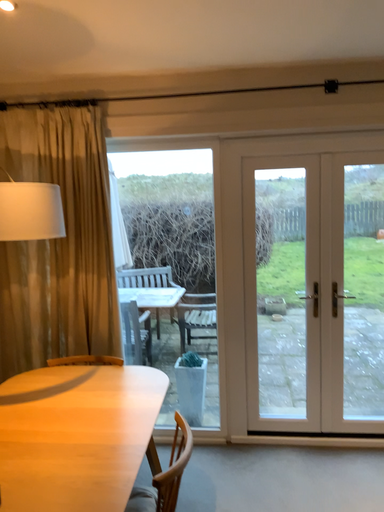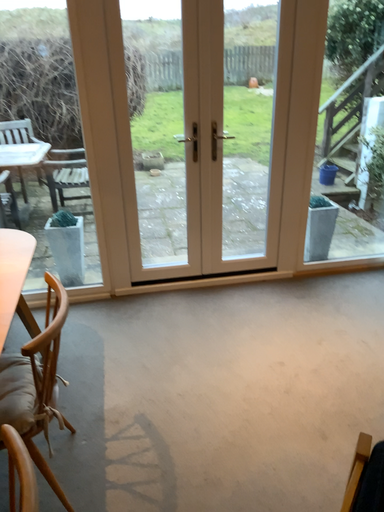
Question: Which way did the camera rotate in the video?

Choices:
 (A) rotated downward
 (B) rotated upward

Answer: (A)